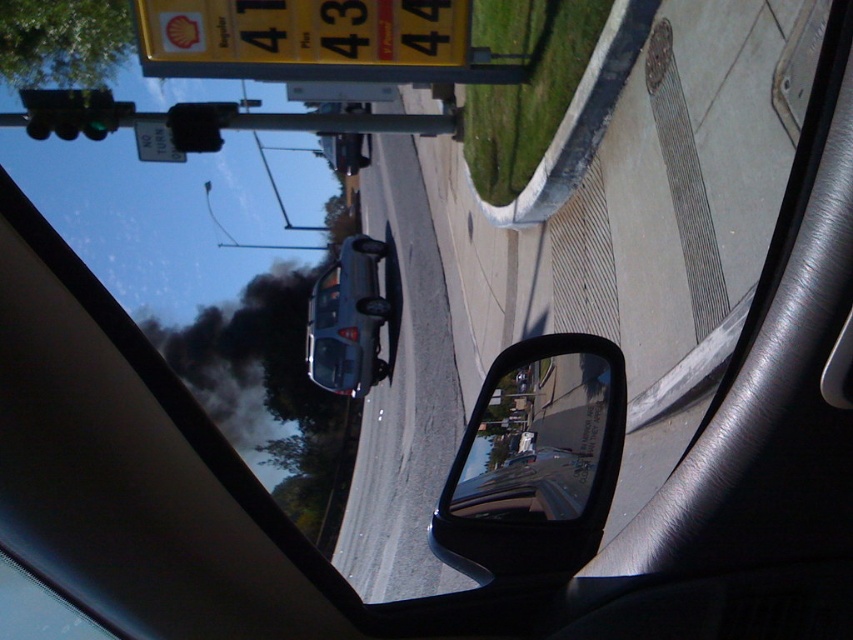
Does satin silver sedan at center have a greater height compared to black plastic traffic light at upper left?

Yes.

Is satin silver sedan at center in front of black plastic traffic light at upper left?

No, satin silver sedan at center is behind black plastic traffic light at upper left.

Is point (370, 244) farther from viewer compared to point (173, 108)?

Yes.

At what (x,y) coordinates should I click in order to perform the action: click on satin silver sedan at center. Please return your answer as a coordinate pair (x, y). The width and height of the screenshot is (853, 640). Looking at the image, I should click on (347, 321).

Which is above, black glossy side mirror at lower right or green glass traffic light at upper left?

green glass traffic light at upper left is above.

Who is positioned more to the left, black glossy side mirror at lower right or green glass traffic light at upper left?

green glass traffic light at upper left is more to the left.

Does point (515, 364) come in front of point (105, 129)?

Yes, it is.

At what (x,y) coordinates should I click in order to perform the action: click on black glossy side mirror at lower right. Please return your answer as a coordinate pair (x, y). The image size is (853, 640). Looking at the image, I should click on (535, 460).

Between point (299, 342) and point (62, 138), which one is positioned behind?

The point (299, 342) is more distant.

Is point (228, 328) more distant than point (90, 124)?

Yes, point (228, 328) is behind point (90, 124).

Locate an element on the screen. black smoke at upper left is located at coordinates (251, 362).